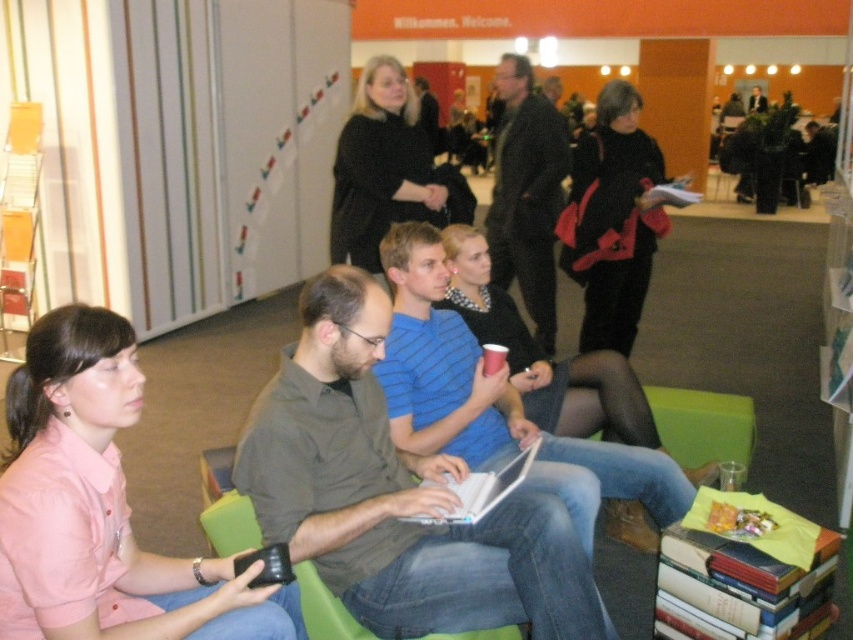
Does dark gray jacket at center appear on the right side of blue striped shirt at center?

Yes, dark gray jacket at center is to the right of blue striped shirt at center.

Find the location of a particular element. dark gray jacket at center is located at coordinates (526, 193).

Between point (532, 257) and point (448, 516), which one is positioned behind?

The point (532, 257) is more distant.

Which of these two, dark gray jacket at center or white plastic laptop at center, stands taller?

Standing taller between the two is dark gray jacket at center.

Is point (550, 296) closer to viewer compared to point (422, 516)?

That is False.

I want to click on dark gray jacket at center, so click(x=526, y=193).

Which is behind, point (378, 486) or point (640, 161)?

Positioned behind is point (640, 161).

This screenshot has width=853, height=640. Find the location of `matte brown shirt at center`. matte brown shirt at center is located at coordinates (395, 493).